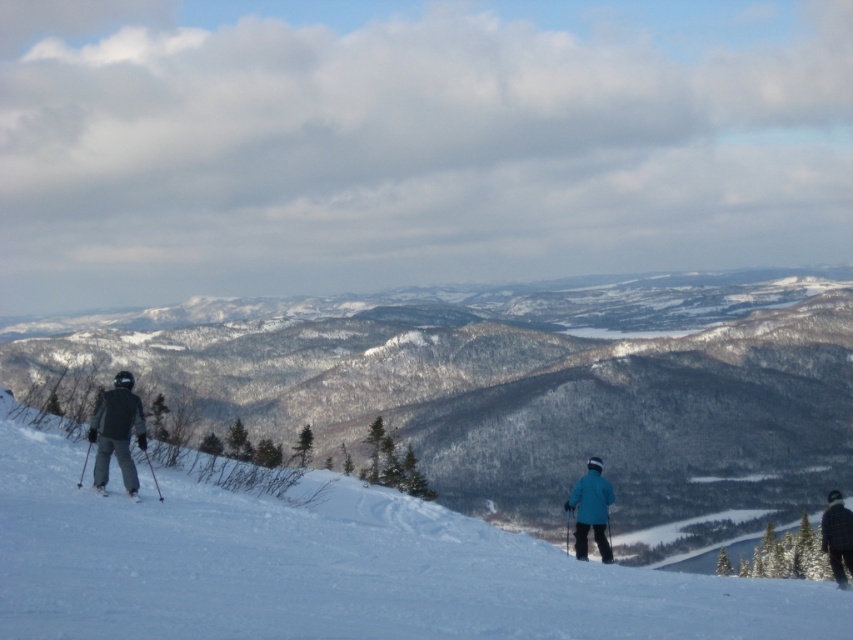
Question: In this image, where is blue matte jacket at lower center located relative to matte black ski at lower left?

Choices:
 (A) above
 (B) below

Answer: (B)

Question: Is plaid wool jacket at lower right further to the viewer compared to matte black ski at lower left?

Choices:
 (A) no
 (B) yes

Answer: (B)

Question: Among these objects, which one is nearest to the camera?

Choices:
 (A) dark gray ski suit at left
 (B) plaid wool jacket at lower right
 (C) white matte snow at center

Answer: (C)

Question: Which of the following is the farthest from the observer?

Choices:
 (A) white matte snow at center
 (B) matte black ski at lower left
 (C) plaid wool jacket at lower right

Answer: (C)

Question: Which point appears closest to the camera in this image?

Choices:
 (A) (128, 493)
 (B) (833, 518)
 (C) (114, 448)

Answer: (A)

Question: Can you confirm if white matte snow at center is wider than blue matte jacket at lower center?

Choices:
 (A) no
 (B) yes

Answer: (B)